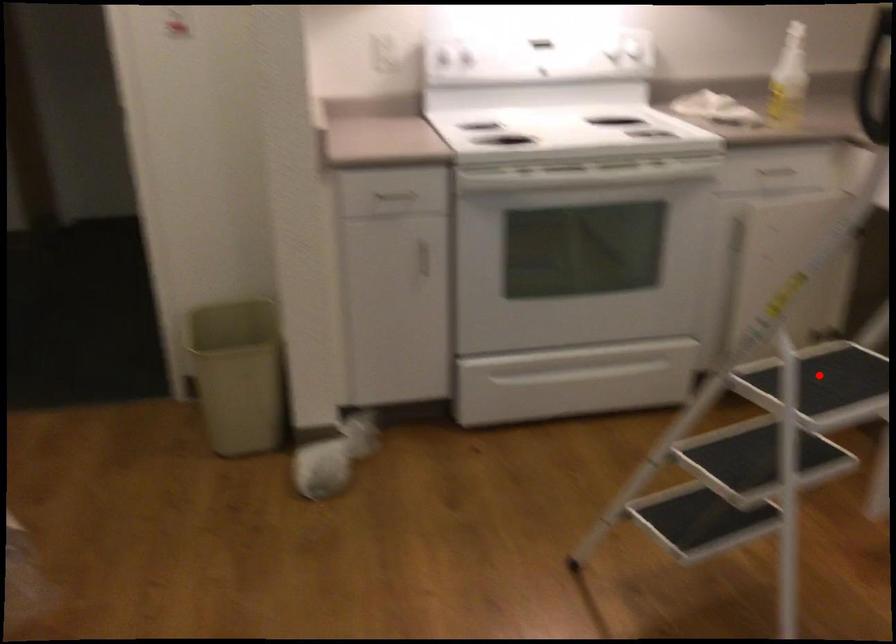
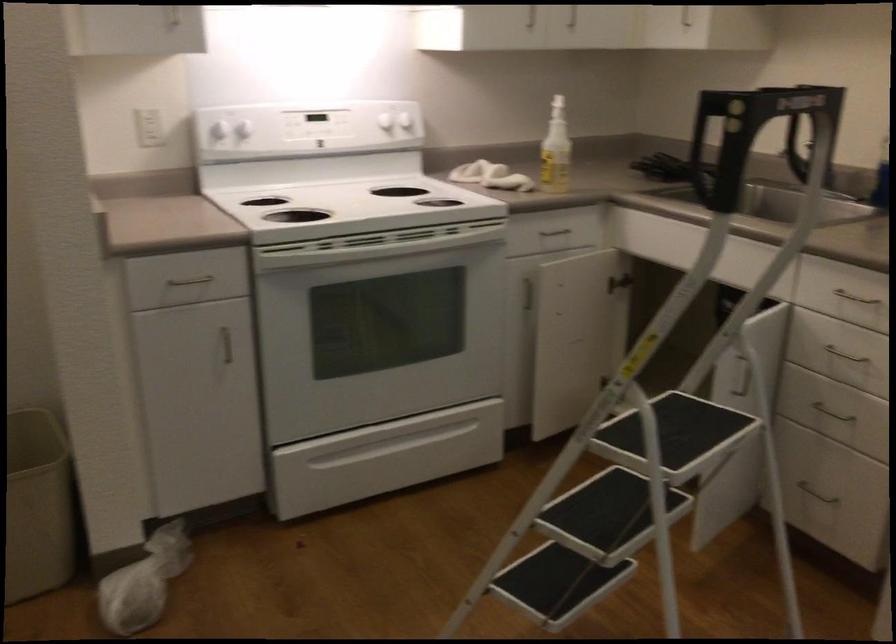
The point at the highlighted location is marked in the first image. Where is the corresponding point in the second image?

(676, 429)